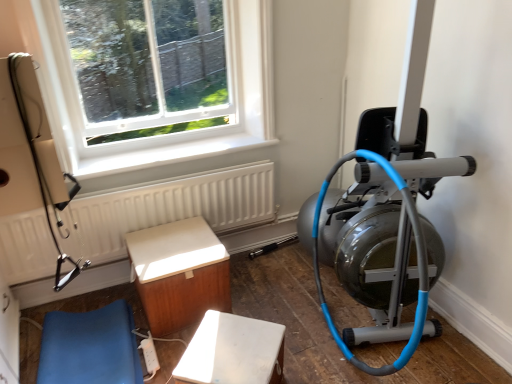
In order to click on vacant space that is to the left of silver metallic stationary bicycle at right in this screenshot , I will do click(287, 329).